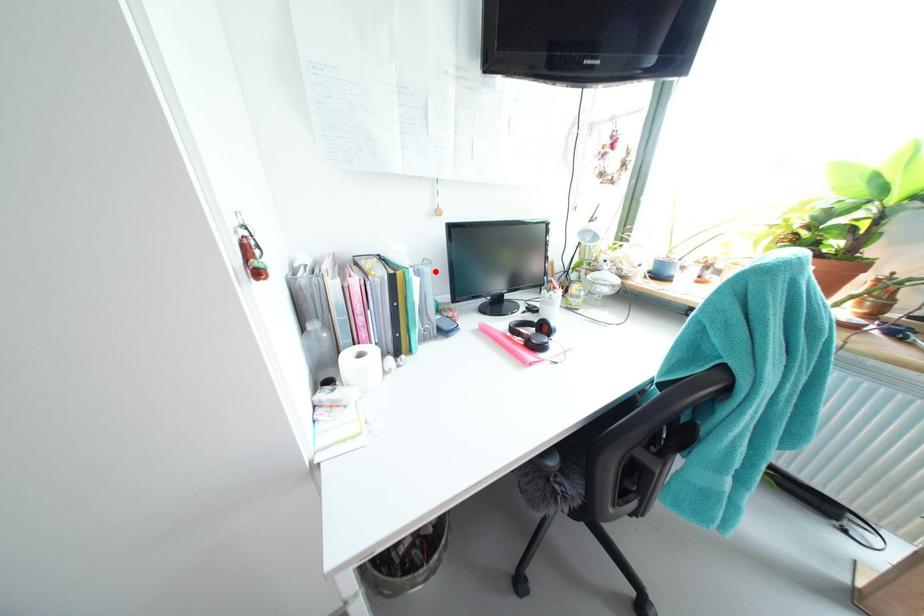
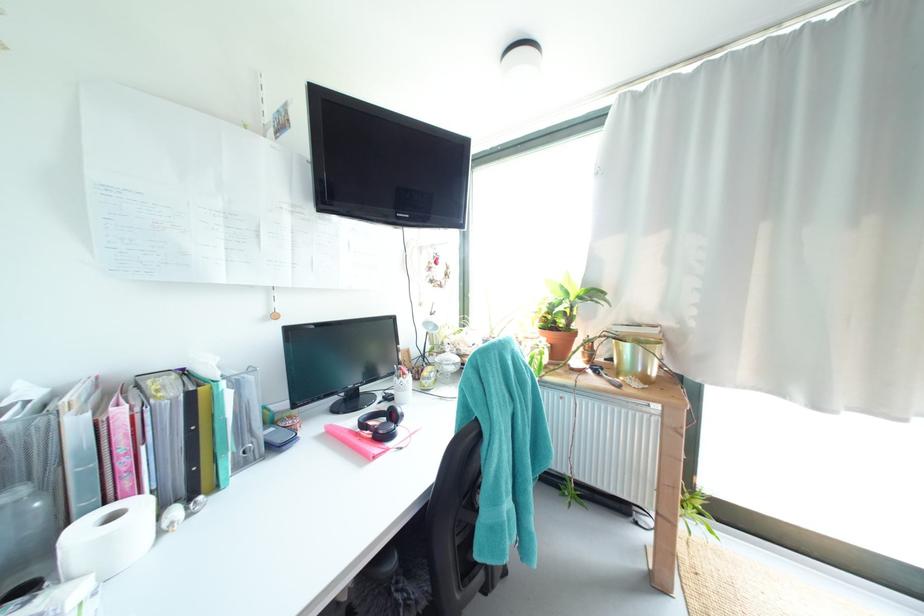
In the second image, find the point that corresponds to the highlighted location in the first image.

(259, 379)